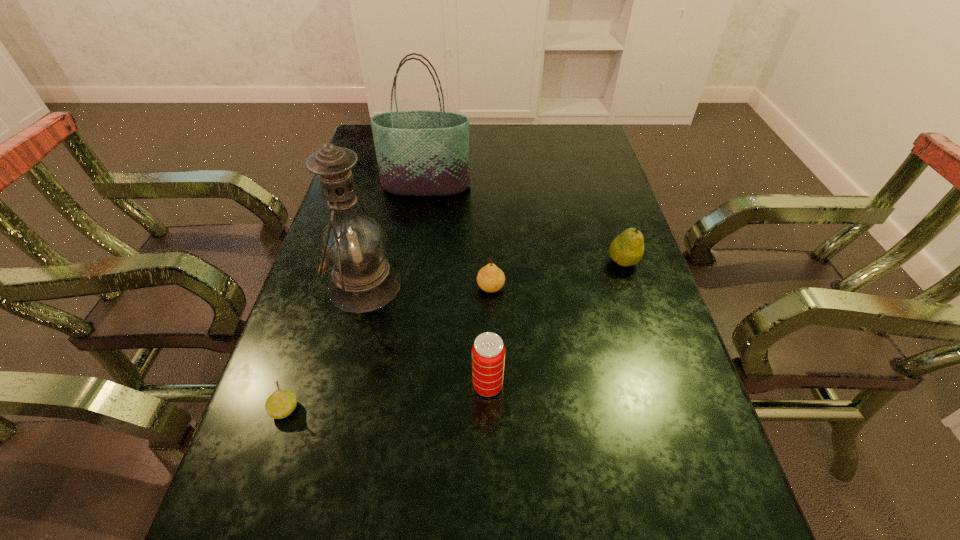
This screenshot has width=960, height=540. I want to click on tote bag, so click(x=419, y=153).

At what (x,y) coordinates should I click in order to perform the action: click on oil lamp. Please return your answer as a coordinate pair (x, y). The width and height of the screenshot is (960, 540). Looking at the image, I should click on (353, 245).

At what (x,y) coordinates should I click in order to perform the action: click on soda can. Please return your answer as a coordinate pair (x, y). The width and height of the screenshot is (960, 540). Looking at the image, I should click on (488, 351).

Find the location of a particular element. This screenshot has height=540, width=960. the third shortest object is located at coordinates (627, 249).

I want to click on the rightmost object, so click(x=627, y=249).

Image resolution: width=960 pixels, height=540 pixels. I want to click on the second farthest pear, so click(x=490, y=278).

Locate an element on the screen. This screenshot has height=540, width=960. the nearest pear is located at coordinates (280, 404).

At what (x,y) coordinates should I click in order to perform the action: click on free space located on the front of the farthest object. Please return your answer as a coordinate pair (x, y). This screenshot has height=540, width=960. Looking at the image, I should click on (422, 212).

At what (x,y) coordinates should I click in order to perform the action: click on vacant space located on the front of the oil lamp. Please return your answer as a coordinate pair (x, y). The height and width of the screenshot is (540, 960). Looking at the image, I should click on coord(326,439).

At what (x,y) coordinates should I click in order to perform the action: click on vacant space located 0.150m on the back of the soda can. Please return your answer as a coordinate pair (x, y). The width and height of the screenshot is (960, 540). Looking at the image, I should click on (487, 315).